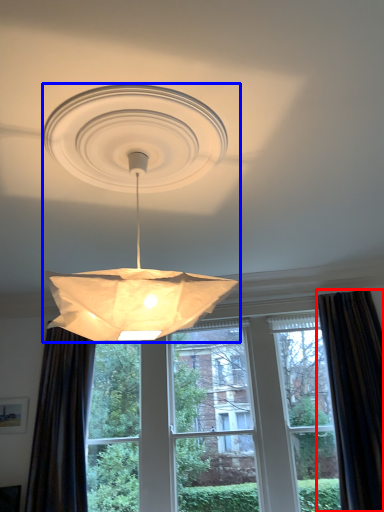
Question: Which of the following is the farthest to the observer, curtain (highlighted by a red box) or lamp (highlighted by a blue box)?

Choices:
 (A) curtain
 (B) lamp

Answer: (A)